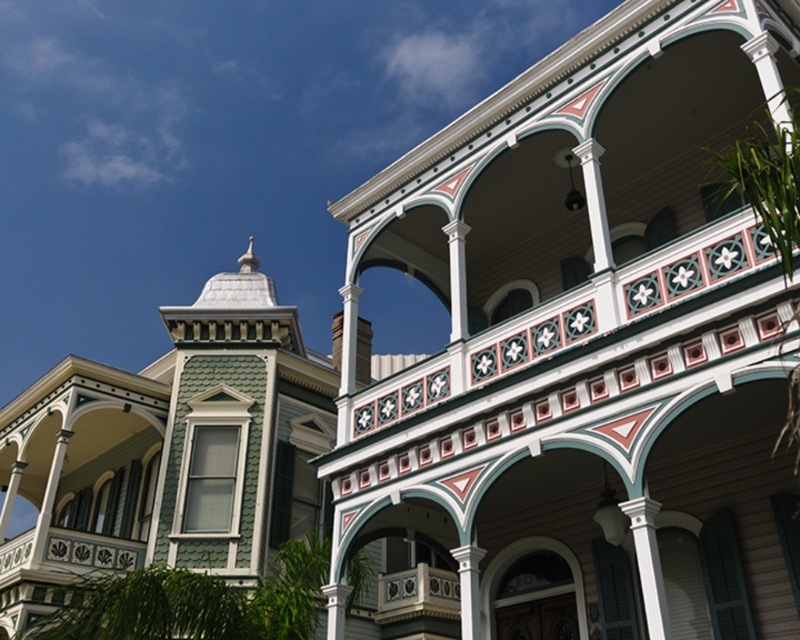
You are standing in front of the historic house and want to take a photo that includes both point (420,577) and point (464,259). Which point should you focus on first to ensure both are in focus?

You should focus on point (464,259) first because it is closer to you than point (420,577), which is further away. By focusing on the closer point, the further one will also be in focus due to the depth of field.